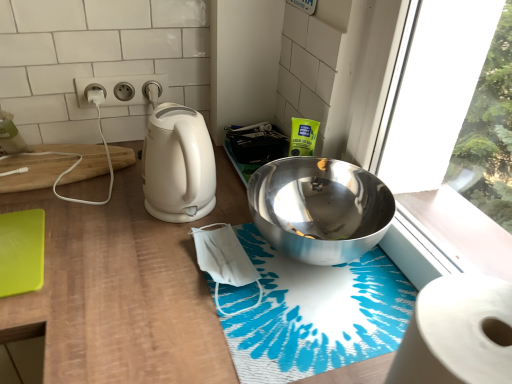
Image resolution: width=512 pixels, height=384 pixels. Identify the location of vacant area on top of blue printed bath mat at center (from a real-world perspective). (308, 281).